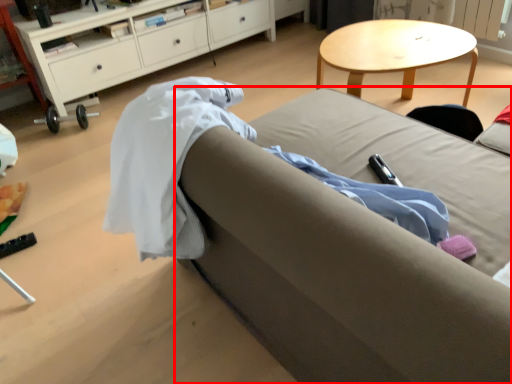
Question: From the image's perspective, where is studio couch (annotated by the red box) located relative to cabinetry?

Choices:
 (A) above
 (B) below

Answer: (B)